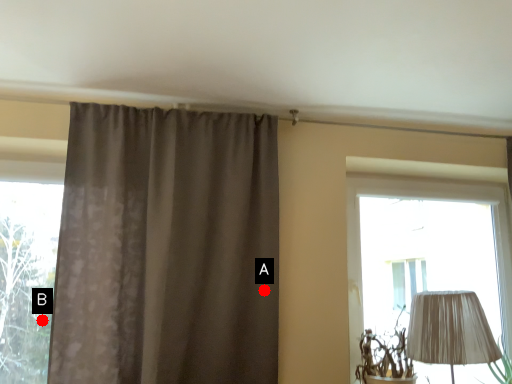
Question: Two points are circled on the image, labeled by A and B beside each circle. Which point appears farthest from the camera in this image?

Choices:
 (A) A is further
 (B) B is further

Answer: (A)